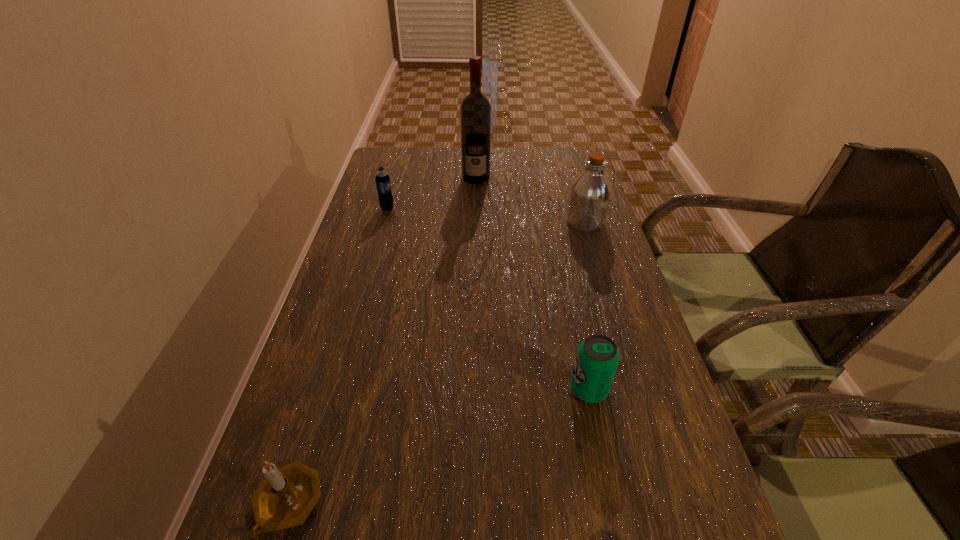
Identify the location of the farthest object. This screenshot has height=540, width=960. (475, 111).

This screenshot has width=960, height=540. I want to click on alcohol, so click(475, 111).

Locate an element on the screen. the fourth shortest object is located at coordinates (590, 193).

Image resolution: width=960 pixels, height=540 pixels. What are the coordinates of `the rightmost object` in the screenshot? It's located at (590, 193).

You are a GUI agent. You are given a task and a screenshot of the screen. Output one action in this format:
    pyautogui.click(x=<x>, y=<y>)
    Task: Click on the left pop soda
    The width and height of the screenshot is (960, 540).
    Given the screenshot: What is the action you would take?
    [382, 179]

What are the coordinates of `the fourth farthest object` in the screenshot? It's located at (597, 358).

The image size is (960, 540). Identify the location of the right pop soda. (597, 358).

The height and width of the screenshot is (540, 960). I want to click on vacant region located on the front and back of the farthest object, so click(476, 199).

Identify the location of vacant region located 0.400m on the back of the rightmost object. This screenshot has height=540, width=960. (564, 151).

Find the location of a particular element. The height and width of the screenshot is (540, 960). vacant area located 0.110m on the back of the left pop soda is located at coordinates (394, 185).